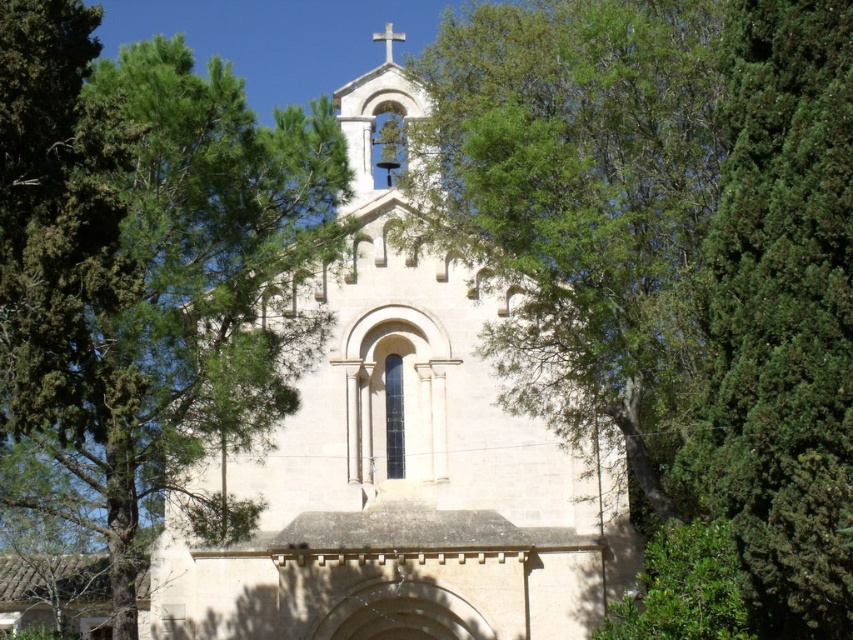
Between green leafy tree at upper left and white stone church at center, which one appears on the left side from the viewer's perspective?

Positioned to the left is green leafy tree at upper left.

The width and height of the screenshot is (853, 640). What are the coordinates of `green leafy tree at upper left` in the screenshot? It's located at (148, 273).

Can you confirm if green leafy tree at center is smaller than green leafy tree at upper left?

Incorrect, green leafy tree at center is not smaller in size than green leafy tree at upper left.

I want to click on green leafy tree at center, so click(x=670, y=253).

Locate an element on the screen. The image size is (853, 640). green leafy tree at center is located at coordinates (670, 253).

Who is lower down, green leafy tree at center or white stone church at center?

green leafy tree at center

The image size is (853, 640). What do you see at coordinates (670, 253) in the screenshot?
I see `green leafy tree at center` at bounding box center [670, 253].

This screenshot has width=853, height=640. What are the coordinates of `green leafy tree at center` in the screenshot? It's located at (670, 253).